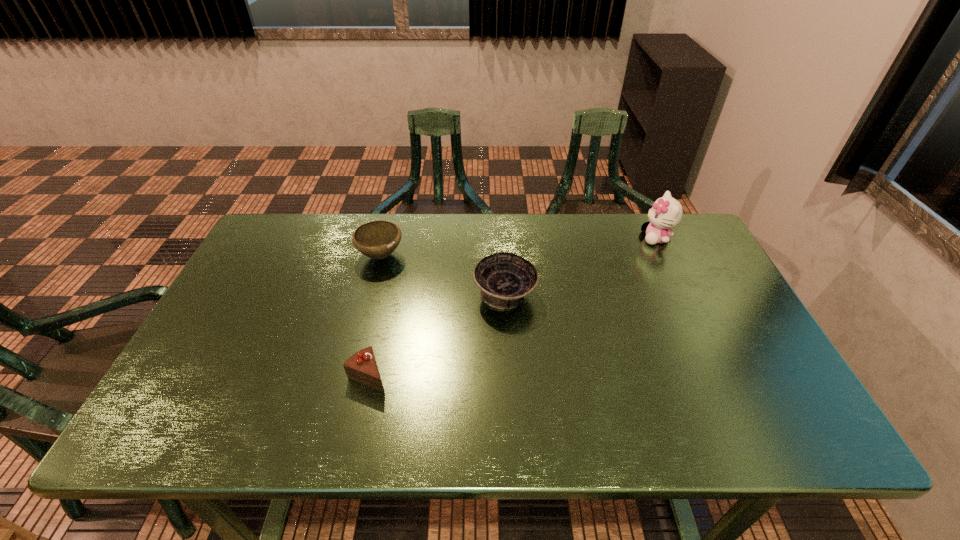
The width and height of the screenshot is (960, 540). What are the coordinates of `the rightmost object` in the screenshot? It's located at pos(666,213).

Find the location of `the tallest object`. the tallest object is located at coordinates (666, 213).

Identify the location of the farther bowl. This screenshot has width=960, height=540. (378, 239).

At what (x,y) coordinates should I click in order to perform the action: click on the second object from right to left. Please return your answer as a coordinate pair (x, y). Looking at the image, I should click on (505, 279).

Locate an element on the screen. This screenshot has height=540, width=960. the nearer bowl is located at coordinates (505, 279).

Locate an element on the screen. The image size is (960, 540). chocolate cake is located at coordinates (361, 367).

At what (x,y) coordinates should I click in order to perform the action: click on the shortest object. Please return your answer as a coordinate pair (x, y). The height and width of the screenshot is (540, 960). Looking at the image, I should click on (361, 367).

This screenshot has width=960, height=540. In order to click on free space located on the front-facing side of the rightmost object in this screenshot , I will do `click(619, 238)`.

Image resolution: width=960 pixels, height=540 pixels. I want to click on free space located on the front-facing side of the rightmost object, so click(579, 238).

Identify the location of free space located 0.050m on the front-facing side of the rightmost object. The width and height of the screenshot is (960, 540). (626, 238).